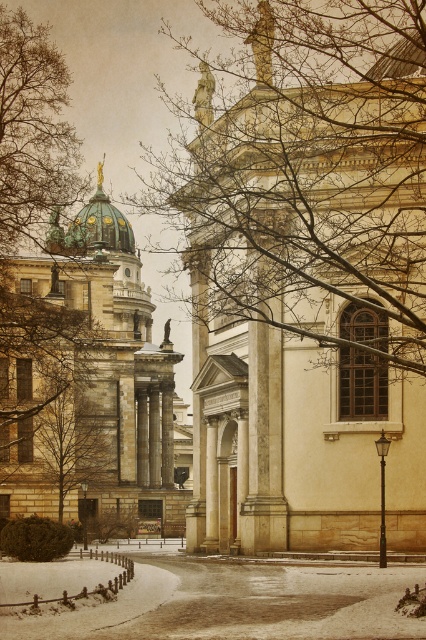
You are an artist planning to paint the winter scene. You want to emphasize the contrast between the bare branches at center and the green marble church at left. Which object should you paint first to ensure proper layering?

The bare branches at center should be painted first because they are larger and likely closer to the viewer than the green marble church at left, allowing for proper layering in the painting.

You are standing in the winter scene and want to walk from the point at coordinates point (63, 385) to the point at coordinates point (54, 211). Which direction should you move to get closer to your destination?

To move from point (63, 385) to point (54, 211), you should move towards the left and slightly forward since point (63, 385) is in front of point (54, 211).

Consider the image. You are a photographer standing at the edge of the snowfield. You want to capture a photo of the classical building on the right without the bare branches at center blocking the view. Can you do that?

The bare branches at center are 50.14 meters away from the camera, so if you move forward to reduce the distance between you and the building, you might be able to position yourself such that the branches no longer block the view of the classical building on the right.